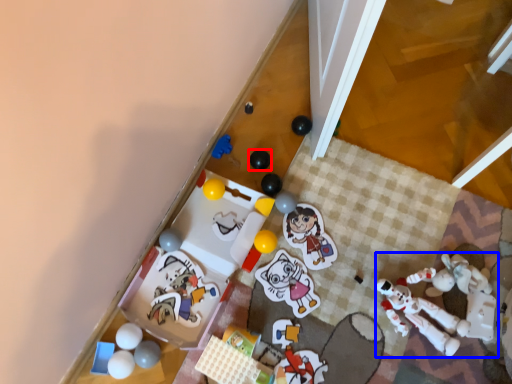
Question: Among these objects, which one is farthest to the camera, toy (highlighted by a red box) or toy (highlighted by a blue box)?

Choices:
 (A) toy
 (B) toy

Answer: (A)